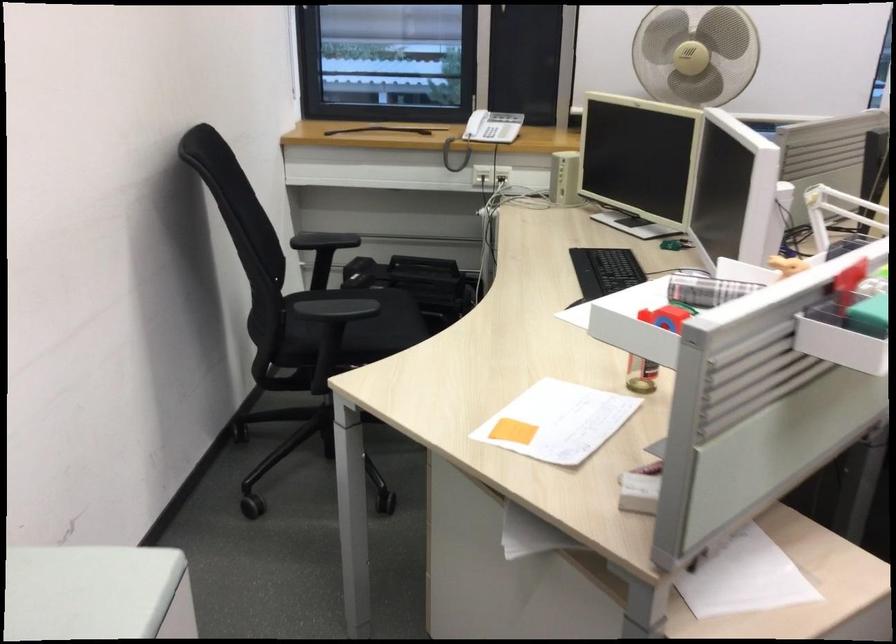
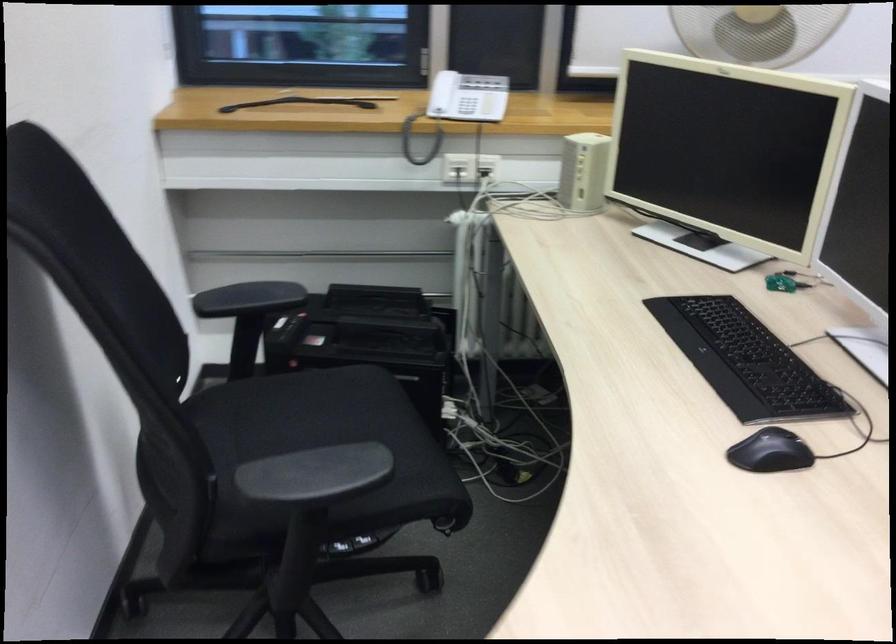
Question: How did the camera likely rotate?

Choices:
 (A) Left
 (B) Right
 (C) Up
 (D) Down

Answer: (B)